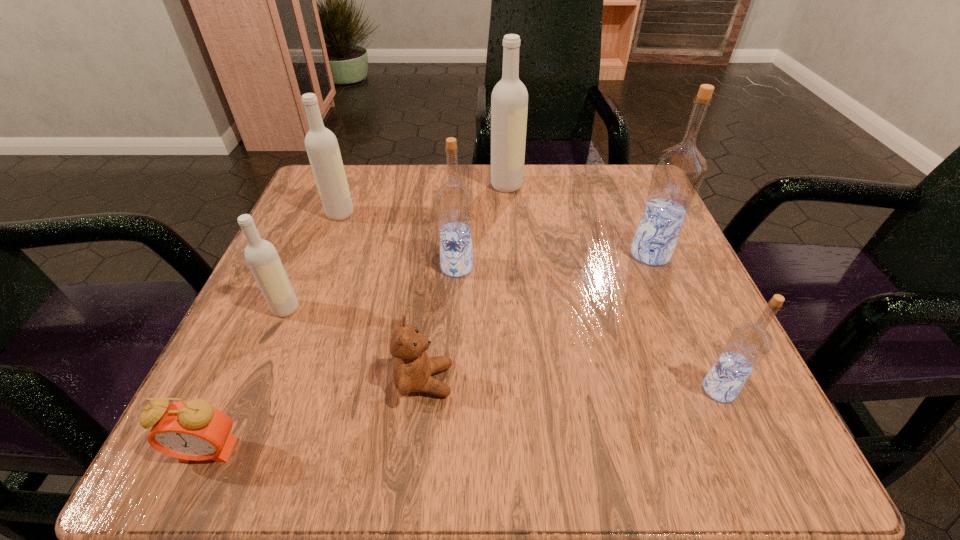
Point out which blue vodka is positioned as the nearest to the fifth farthest object. Please provide its 2D coordinates. Your answer should be formatted as a tuple, i.e. [(x, y)], where the tuple contains the x and y coordinates of a point satisfying the conditions above.

[(453, 201)]

Identify which blue vodka is located as the third nearest to the nearest object. Please provide its 2D coordinates. Your answer should be formatted as a tuple, i.e. [(x, y)], where the tuple contains the x and y coordinates of a point satisfying the conditions above.

[(678, 172)]

The height and width of the screenshot is (540, 960). Identify the location of free space in the image that satisfies the following two spatial constraints: 1. on the front side of the biggest blue vodka; 2. on the face of the teddy bear. (704, 381).

Find the location of a particular element. This screenshot has width=960, height=540. vacant space that satisfies the following two spatial constraints: 1. on the face of the teddy bear; 2. on the face of the alarm clock is located at coordinates (418, 450).

Where is `vacant space that satisfies the following two spatial constraints: 1. on the face of the teddy bear; 2. on the face of the nearest object`? Image resolution: width=960 pixels, height=540 pixels. vacant space that satisfies the following two spatial constraints: 1. on the face of the teddy bear; 2. on the face of the nearest object is located at coordinates (418, 450).

Locate an element on the screen. vacant point that satisfies the following two spatial constraints: 1. on the face of the brown teddy bear; 2. on the left side of the nearest blue vodka is located at coordinates (423, 389).